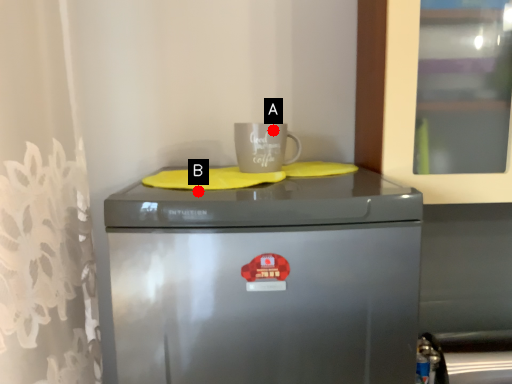
Question: Two points are circled on the image, labeled by A and B beside each circle. Which point is farther from the camera taking this photo?

Choices:
 (A) A is further
 (B) B is further

Answer: (A)